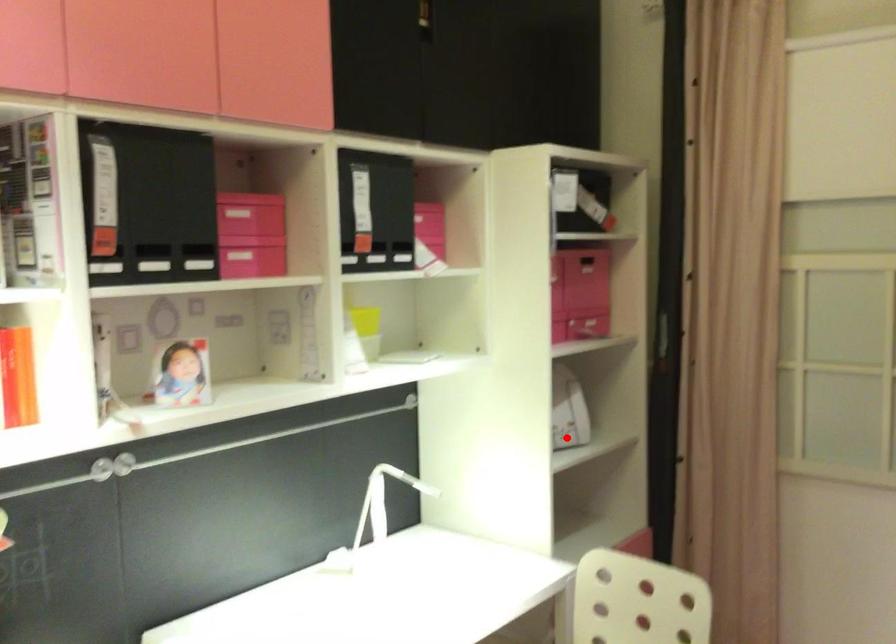
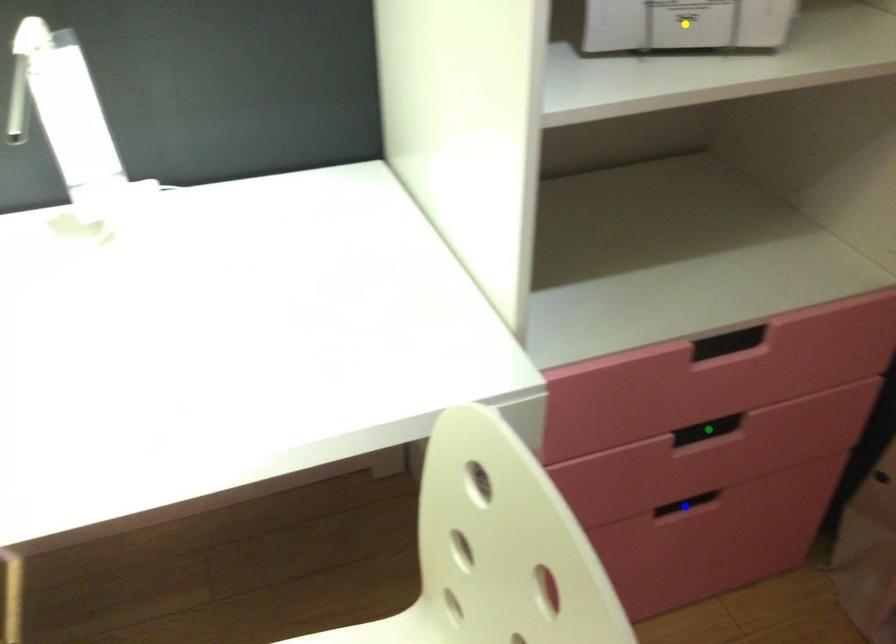
Question: I am providing you with two images of the same scene from different viewpoints. A red point is marked on the first image. You are given multiple points on the second image. Which spot in image 2 lines up with the point in image 1?

Choices:
 (A) blue point
 (B) yellow point
 (C) green point

Answer: (B)